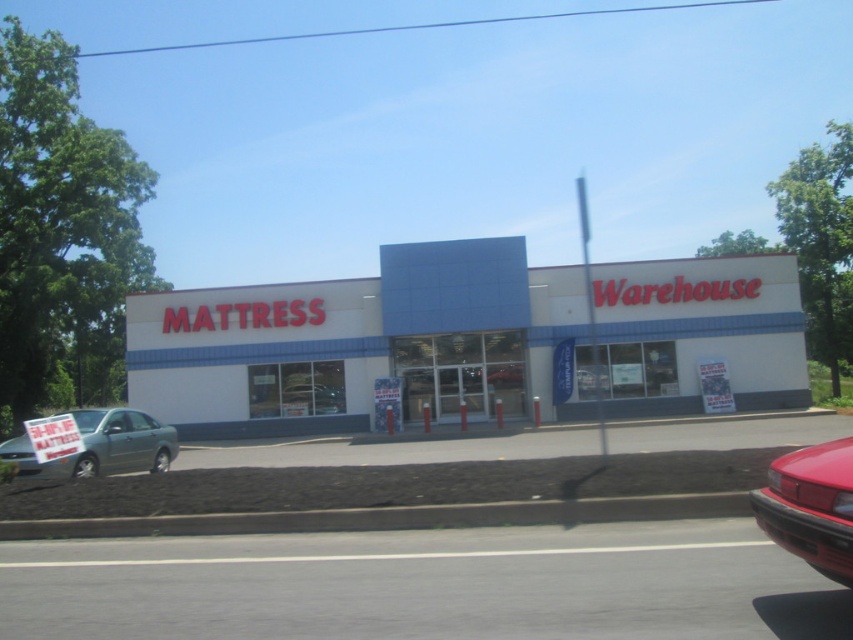
Is point (770, 476) less distant than point (61, 426)?

Yes, it is in front of point (61, 426).

This screenshot has height=640, width=853. Find the location of `shiny red car at lower right`. shiny red car at lower right is located at coordinates (811, 506).

Does white matte building at center have a lesser height compared to green matte sedan at lower left?

No, white matte building at center is not shorter than green matte sedan at lower left.

In the scene shown: Does white matte building at center lie behind green matte sedan at lower left?

Yes.

Locate an element on the screen. white matte building at center is located at coordinates (364, 342).

Is green matte sedan at lower left above matte black mattress sign at lower left?

Incorrect, green matte sedan at lower left is not positioned above matte black mattress sign at lower left.

Is green matte sedan at lower left thinner than matte black mattress sign at lower left?

No, green matte sedan at lower left is not thinner than matte black mattress sign at lower left.

Does point (125, 406) come behind point (28, 435)?

Yes, point (125, 406) is farther from viewer.

Locate an element on the screen. Image resolution: width=853 pixels, height=640 pixels. green matte sedan at lower left is located at coordinates (102, 445).